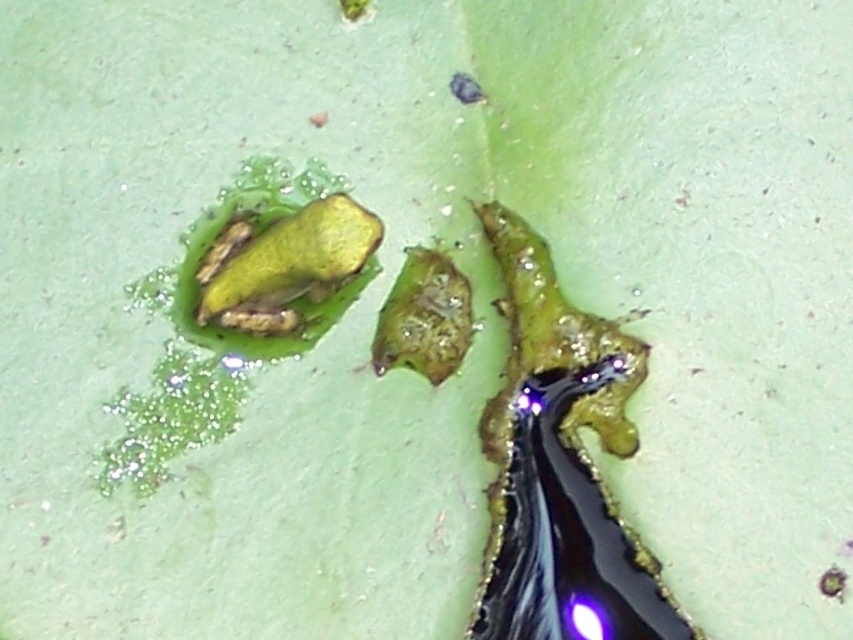
Does glossy green frog at center have a greater width compared to green matte frog at center?

Correct, the width of glossy green frog at center exceeds that of green matte frog at center.

Does glossy green frog at center have a larger size compared to green matte frog at center?

Correct, glossy green frog at center is larger in size than green matte frog at center.

Who is more forward, (532,344) or (198,312)?

Point (198,312) is more forward.

Find the location of a particular element. This screenshot has width=853, height=640. glossy green frog at center is located at coordinates (560, 465).